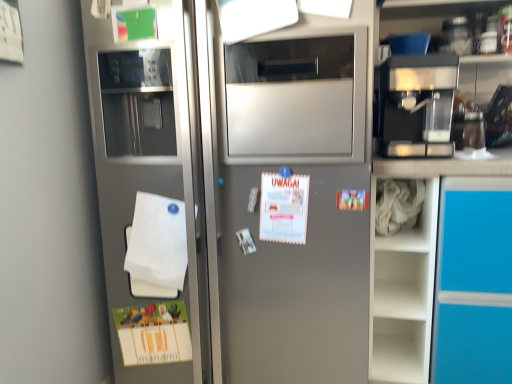
Question: Considering the relative sizes of white fabric at right and white matte paper at upper center in the image provided, is white fabric at right taller than white matte paper at upper center?

Choices:
 (A) yes
 (B) no

Answer: (B)

Question: From a real-world perspective, is white fabric at right over white matte paper at upper center?

Choices:
 (A) no
 (B) yes

Answer: (A)

Question: Can you confirm if white fabric at right is smaller than white matte paper at upper center?

Choices:
 (A) yes
 (B) no

Answer: (B)

Question: Is white fabric at right oriented towards white matte paper at upper center?

Choices:
 (A) no
 (B) yes

Answer: (A)

Question: Is white fabric at right at the left side of white matte paper at upper center?

Choices:
 (A) no
 (B) yes

Answer: (A)

Question: Is white fabric at right behind white matte paper at upper center?

Choices:
 (A) yes
 (B) no

Answer: (A)

Question: From the image's perspective, is satin silver refrigerator at left above white matte paper at upper center?

Choices:
 (A) yes
 (B) no

Answer: (B)

Question: Is satin silver refrigerator at left surrounding white matte paper at upper center?

Choices:
 (A) yes
 (B) no

Answer: (A)

Question: From a real-world perspective, is satin silver refrigerator at left over white matte paper at upper center?

Choices:
 (A) yes
 (B) no

Answer: (B)

Question: Is satin silver refrigerator at left not near white matte paper at upper center?

Choices:
 (A) no
 (B) yes

Answer: (A)

Question: Considering the relative sizes of satin silver refrigerator at left and white matte paper at upper center in the image provided, is satin silver refrigerator at left smaller than white matte paper at upper center?

Choices:
 (A) no
 (B) yes

Answer: (A)

Question: Is satin silver refrigerator at left not inside white matte paper at upper center?

Choices:
 (A) no
 (B) yes

Answer: (B)

Question: Does white matte notepad at lower left have a lesser width compared to satin silver refrigerator at left?

Choices:
 (A) no
 (B) yes

Answer: (B)